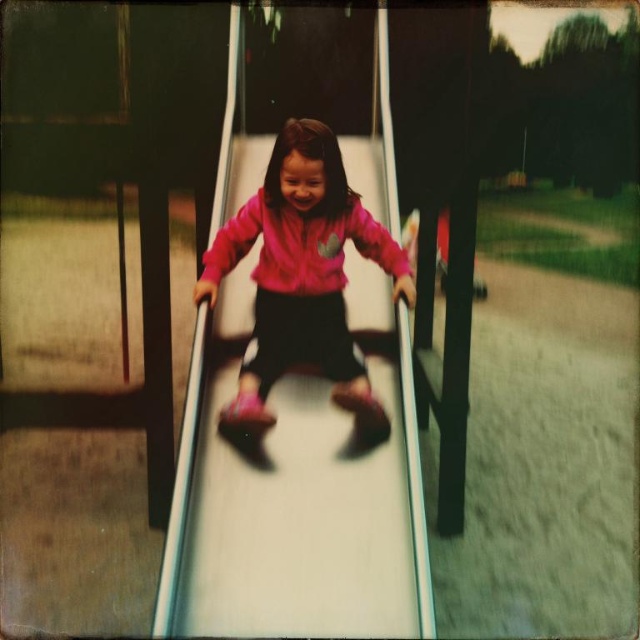
You are a photographer trying to capture a clear photo of the white plastic slide at center and the pink matte jacket at center. Since the slide is larger, which object should you focus on to ensure it fills the frame more appropriately?

The white plastic slide at center is larger in size than the pink matte jacket at center, so you should focus on the white plastic slide at center to ensure it fills the frame more appropriately.

You are a photographer trying to capture the child sliding down the slide. Based on the image, can you determine if the white plastic slide at center is positioned below the pink matte jacket at center?

Yes, the white plastic slide at center is positioned under the pink matte jacket at center, so it is indeed below it.